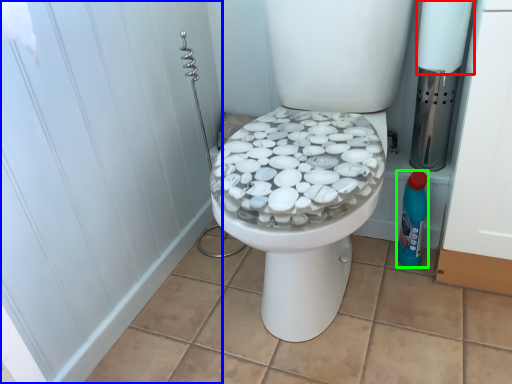
Question: Estimate the real-world distances between objects in this image. Which object is closer to toilet paper (highlighted by a red box), screen door (highlighted by a blue box) or cleaning product (highlighted by a green box)?

Choices:
 (A) screen door
 (B) cleaning product

Answer: (B)